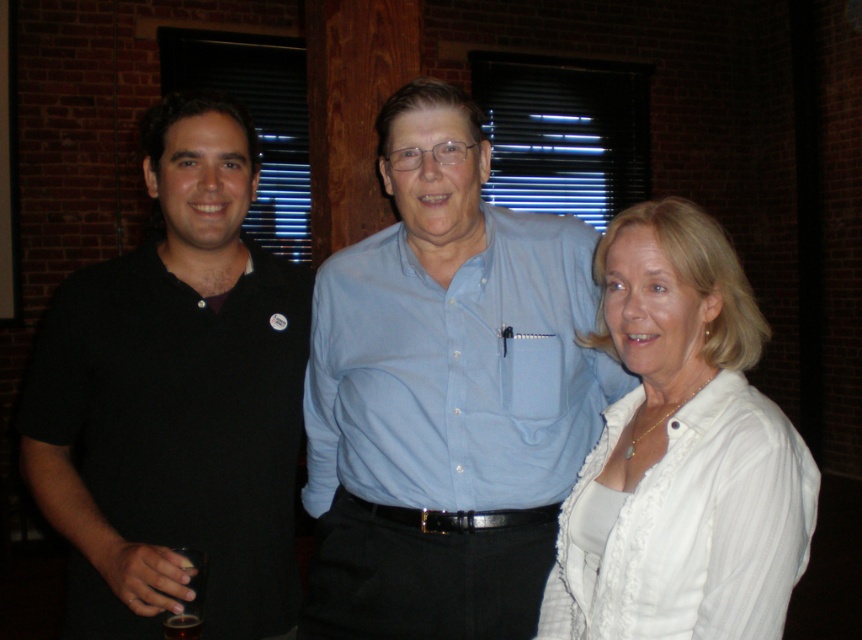
You are standing in front of the three people in the image. You want to hand a gift to the person at point (x=122, y=518) and then to the person at point (x=516, y=278). Which person should you approach first to ensure you can reach them without needing to move around the group?

You should approach the person at point (x=122, y=518) first because they are closer to you than the person at point (x=516, y=278).